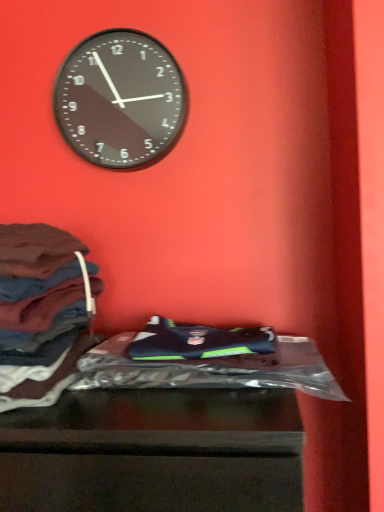
Question: Is shiny plastic bag at lower center completely or partially inside black glass clock at upper center?

Choices:
 (A) no
 (B) yes

Answer: (A)

Question: From a real-world perspective, is black glass clock at upper center over shiny plastic bag at lower center?

Choices:
 (A) no
 (B) yes

Answer: (B)

Question: Is black glass clock at upper center bigger than shiny plastic bag at lower center?

Choices:
 (A) yes
 (B) no

Answer: (B)

Question: Is black glass clock at upper center positioned with its back to shiny plastic bag at lower center?

Choices:
 (A) yes
 (B) no

Answer: (B)

Question: Is black glass clock at upper center shorter than shiny plastic bag at lower center?

Choices:
 (A) no
 (B) yes

Answer: (B)

Question: From the image's perspective, is black glass clock at upper center on shiny plastic bag at lower center?

Choices:
 (A) no
 (B) yes

Answer: (B)

Question: Does shiny plastic bag at center have a lesser height compared to black glass clock at upper center?

Choices:
 (A) yes
 (B) no

Answer: (A)

Question: Is the position of shiny plastic bag at center less distant than that of black glass clock at upper center?

Choices:
 (A) no
 (B) yes

Answer: (B)

Question: From the image's perspective, is shiny plastic bag at center over black glass clock at upper center?

Choices:
 (A) yes
 (B) no

Answer: (B)

Question: Can you confirm if shiny plastic bag at center is positioned to the left of black glass clock at upper center?

Choices:
 (A) no
 (B) yes

Answer: (A)

Question: From a real-world perspective, is shiny plastic bag at center positioned over black glass clock at upper center based on gravity?

Choices:
 (A) no
 (B) yes

Answer: (A)

Question: Does shiny plastic bag at center lie behind black glass clock at upper center?

Choices:
 (A) yes
 (B) no

Answer: (B)

Question: Does black glass clock at upper center come in front of dark brown fabric at left?

Choices:
 (A) no
 (B) yes

Answer: (A)